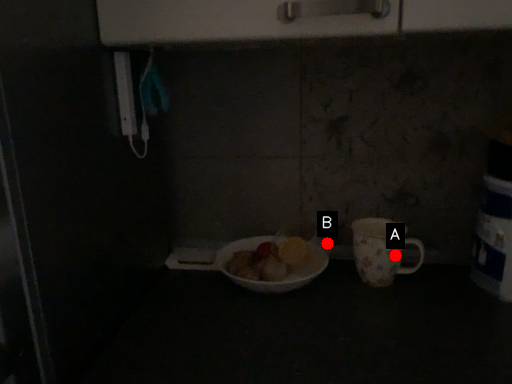
Question: Two points are circled on the image, labeled by A and B beside each circle. Among these points, which one is nearest to the camera?

Choices:
 (A) A is closer
 (B) B is closer

Answer: (A)